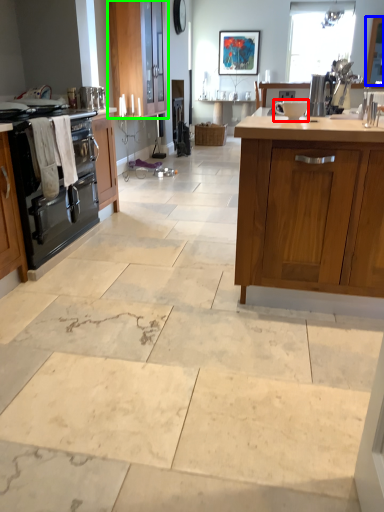
Question: Based on their relative distances, which object is farther from appliance (highlighted by a red box)? Choose from window screen (highlighted by a blue box) and cabinetry (highlighted by a green box).

Choices:
 (A) window screen
 (B) cabinetry

Answer: (B)